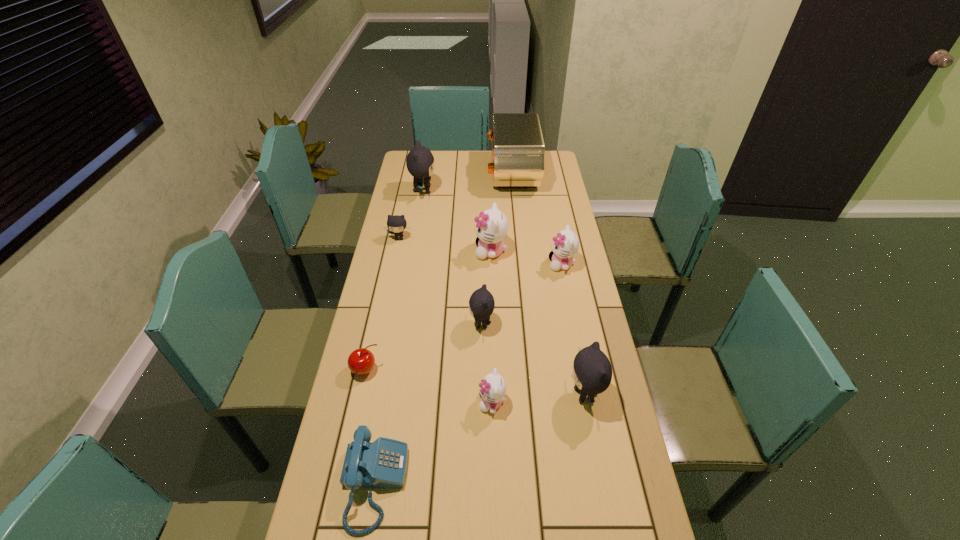
Find the location of `toaster oven`. toaster oven is located at coordinates (518, 151).

Where is `the farthest kitten`? The width and height of the screenshot is (960, 540). the farthest kitten is located at coordinates (420, 162).

Identify the location of the farthest gray kitten. Image resolution: width=960 pixels, height=540 pixels. (420, 162).

I want to click on the biggest white kitten, so click(x=492, y=226).

Find the location of a particular element. This screenshot has width=960, height=540. the nearest gray kitten is located at coordinates (592, 372).

Where is `the rightmost gray kitten`? This screenshot has width=960, height=540. the rightmost gray kitten is located at coordinates (592, 372).

Identify the location of the second smallest white kitten. (565, 245).

Identify the location of the second gray kitten from right to left. (481, 303).

What are the coordinates of `the second smallest gray kitten` in the screenshot? It's located at (481, 303).

Locate an element on the screen. This screenshot has width=960, height=540. the smallest white kitten is located at coordinates (492, 388).